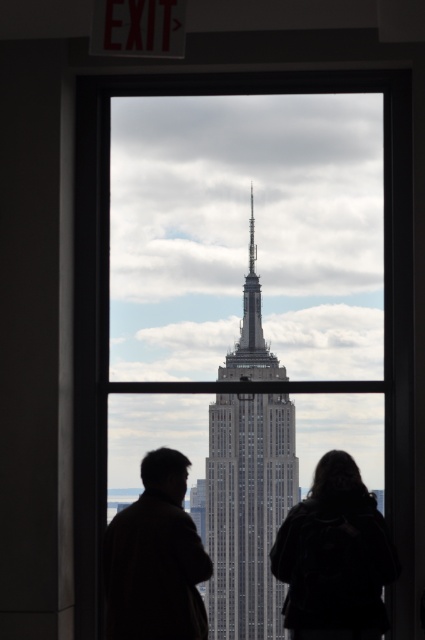
Question: Which point is closer to the camera taking this photo?

Choices:
 (A) (263, 520)
 (B) (102, 388)

Answer: (B)

Question: Which point is closer to the camera?

Choices:
 (A) transparent glass window at center
 (B) brown leather jacket at lower left
 (C) white stone tower at center
 (D) silhouette clothing at center

Answer: (A)

Question: Where is white stone tower at center located in relation to black leather jacket at center in the image?

Choices:
 (A) right
 (B) left

Answer: (B)

Question: Which of these objects is positioned closest to the black leather jacket at center?

Choices:
 (A) white stone tower at center
 (B) transparent glass window at center

Answer: (A)

Question: Is silhouette clothing at center smaller than brown leather jacket at lower left?

Choices:
 (A) no
 (B) yes

Answer: (A)

Question: Does silhouette clothing at center appear under brown leather jacket at lower left?

Choices:
 (A) no
 (B) yes

Answer: (A)